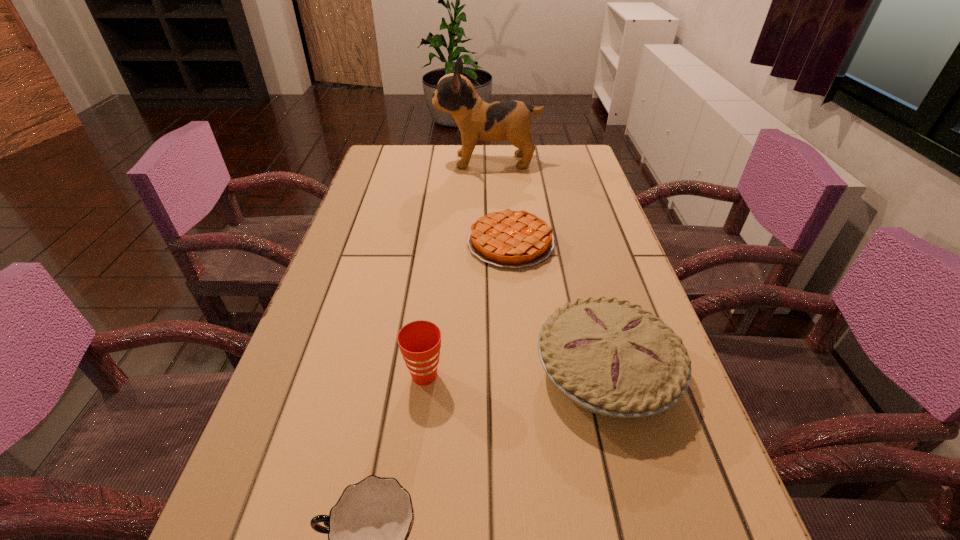
Find the location of a particular element. This screenshot has height=540, width=960. vacant space that satisfies the following two spatial constraints: 1. at the face of the shorter pie; 2. on the right side of the tallest object is located at coordinates (491, 242).